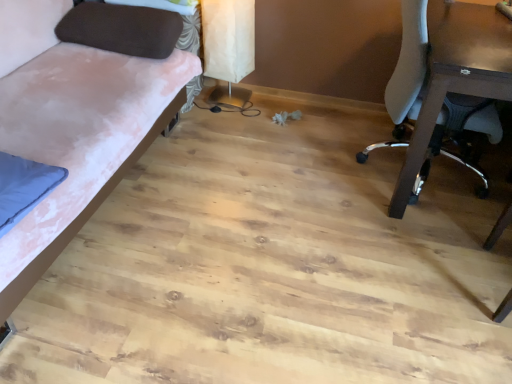
Locate an element on the screen. vacant region to the left of white mesh chair at right is located at coordinates (306, 166).